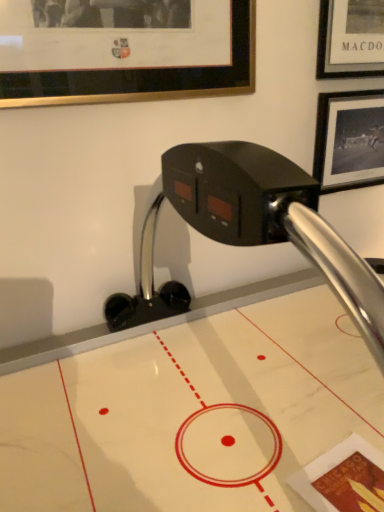
Question: From a real-world perspective, is white marble air hockey table at center physically above gold-framed picture at upper left, the second picture frame positioned from the back?

Choices:
 (A) yes
 (B) no

Answer: (B)

Question: Is white marble air hockey table at center facing away from gold-framed picture at upper left, the 1th picture frame from the left?

Choices:
 (A) no
 (B) yes

Answer: (A)

Question: Does white marble air hockey table at center have a greater width compared to gold-framed picture at upper left, the 1th picture frame from the left?

Choices:
 (A) no
 (B) yes

Answer: (B)

Question: Is white marble air hockey table at center outside gold-framed picture at upper left, the 1th picture frame from the left?

Choices:
 (A) no
 (B) yes

Answer: (B)

Question: Does white marble air hockey table at center appear on the left side of gold-framed picture at upper left, which is counted as the 1th picture frame, starting from the front?

Choices:
 (A) no
 (B) yes

Answer: (A)

Question: From a real-world perspective, relative to gold-framed picture at upper left, acting as the 2th picture frame starting from the right, is white marble air hockey table at center vertically above or below?

Choices:
 (A) above
 (B) below

Answer: (B)

Question: Is white marble air hockey table at center inside or outside of gold-framed picture at upper left, the 1th picture frame from the left?

Choices:
 (A) inside
 (B) outside

Answer: (B)

Question: From the image's perspective, relative to gold-framed picture at upper left, the second picture frame positioned from the back, is white marble air hockey table at center above or below?

Choices:
 (A) below
 (B) above

Answer: (A)

Question: Considering the positions of white marble air hockey table at center and gold-framed picture at upper left, which is counted as the 1th picture frame, starting from the front, in the image, is white marble air hockey table at center wider or thinner than gold-framed picture at upper left, which is counted as the 1th picture frame, starting from the front,?

Choices:
 (A) wide
 (B) thin

Answer: (A)

Question: Is black matte picture frame at upper right, the 2th picture frame viewed from the front, spatially inside gold-framed picture at upper left, acting as the 2th picture frame starting from the right, or outside of it?

Choices:
 (A) outside
 (B) inside

Answer: (A)

Question: In terms of height, does black matte picture frame at upper right, the 2th picture frame in the left-to-right sequence, look taller or shorter compared to gold-framed picture at upper left, acting as the 2th picture frame starting from the right?

Choices:
 (A) short
 (B) tall

Answer: (B)

Question: Is black matte picture frame at upper right, placed as the 1th picture frame when sorted from right to left, in front of or behind gold-framed picture at upper left, the 1th picture frame from the left, in the image?

Choices:
 (A) front
 (B) behind

Answer: (B)

Question: In terms of width, does black matte picture frame at upper right, the first picture frame from the back, look wider or thinner when compared to gold-framed picture at upper left, the second picture frame positioned from the back?

Choices:
 (A) thin
 (B) wide

Answer: (B)

Question: Relative to white marble air hockey table at center, is black matte picture frame at upper right, the first picture frame from the back, in front or behind?

Choices:
 (A) front
 (B) behind

Answer: (B)

Question: From a real-world perspective, is black matte picture frame at upper right, the first picture frame from the back, positioned above or below white marble air hockey table at center?

Choices:
 (A) below
 (B) above

Answer: (B)